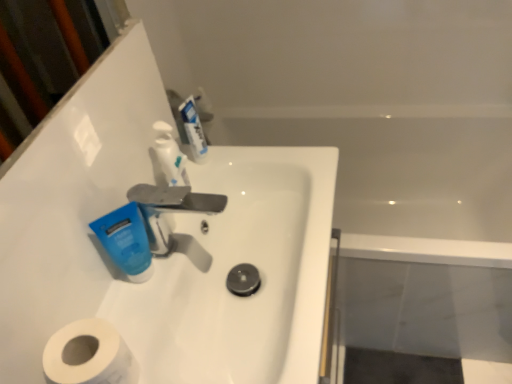
Where is `vacant area that is in front of silver metallic faucet at center`? The height and width of the screenshot is (384, 512). vacant area that is in front of silver metallic faucet at center is located at coordinates (170, 318).